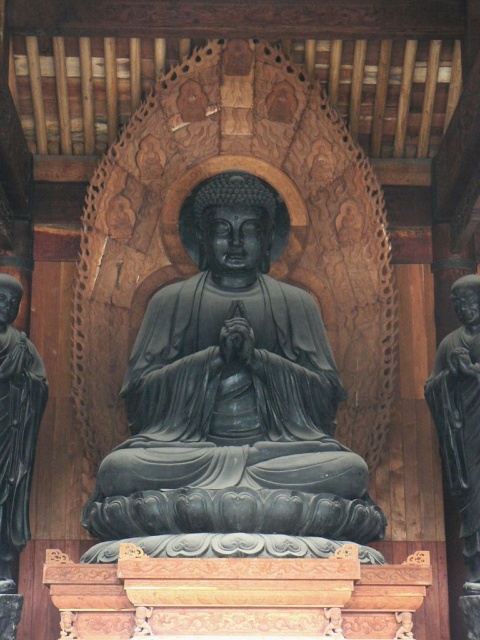
Question: Does black stone statue at right appear under matte black statue at left?

Choices:
 (A) yes
 (B) no

Answer: (A)

Question: Which of these objects is positioned closest to the black polished stone buddha at center?

Choices:
 (A) black stone statue at right
 (B) matte black statue at left

Answer: (B)

Question: Considering the relative positions of black polished stone buddha at center and black stone statue at right in the image provided, where is black polished stone buddha at center located with respect to black stone statue at right?

Choices:
 (A) left
 (B) right

Answer: (A)

Question: Is black polished stone buddha at center in front of matte black statue at left?

Choices:
 (A) no
 (B) yes

Answer: (B)

Question: Among these objects, which one is farthest from the camera?

Choices:
 (A) black polished stone buddha at center
 (B) black stone statue at right

Answer: (B)

Question: Which point appears closest to the camera in this image?

Choices:
 (A) (107, 464)
 (B) (478, 392)
 (C) (36, 406)

Answer: (A)